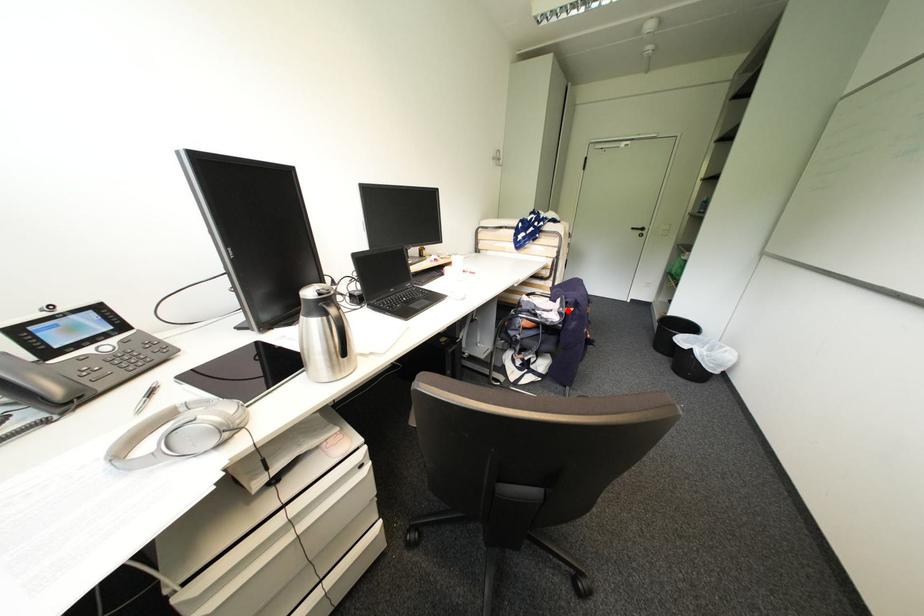
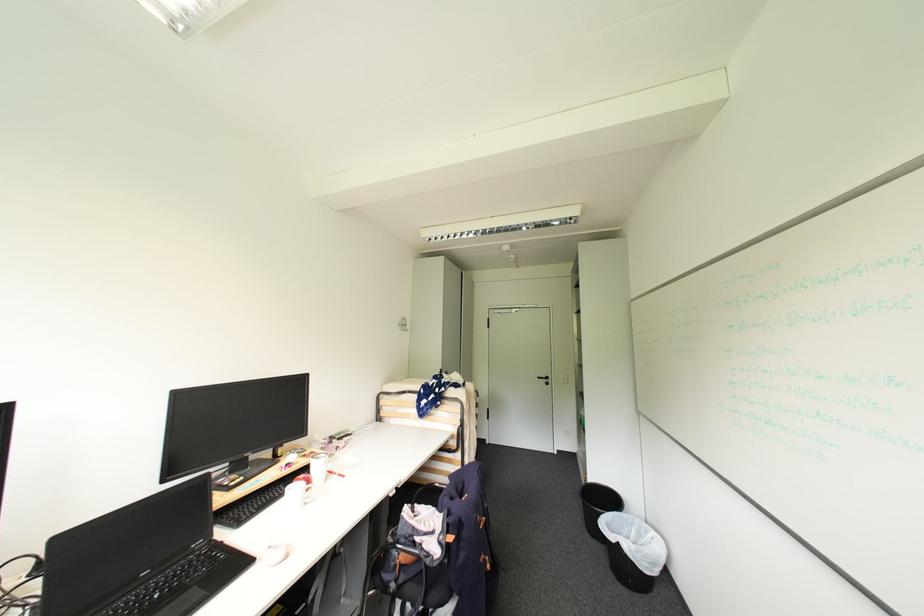
Question: I am providing you with two images of the same scene from different viewpoints. A red point is shown in image1. For the corresponding object point in image2, is it positioned nearer or farther from the camera?

Choices:
 (A) Nearer
 (B) Farther

Answer: (B)